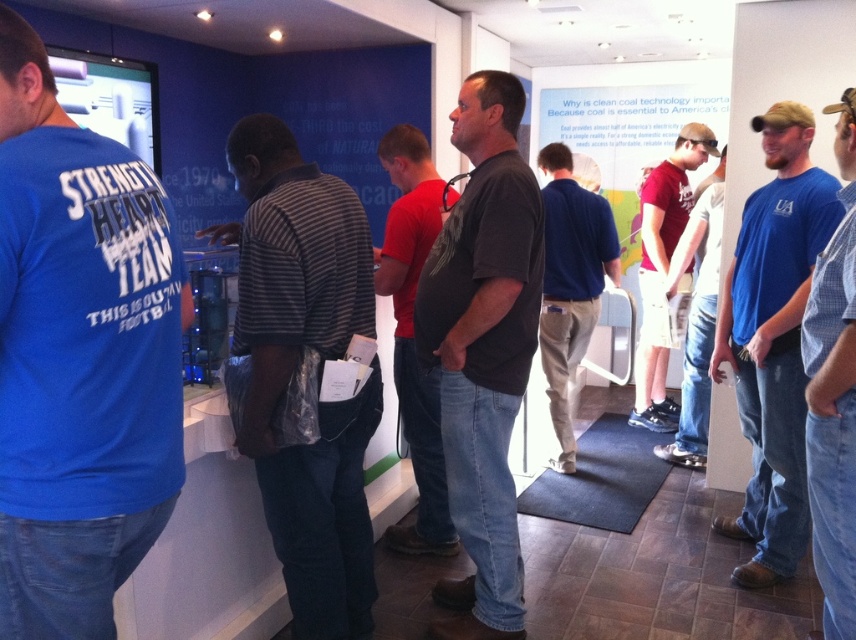
From the picture: You are standing in the exhibition space and see the black matte shirt at center. Can you determine its exact position using the coordinate system provided?

The black matte shirt at center is located at point (483, 349) according to the coordinate system provided.

You are a photographer setting up for a group photo. You notice two people wearing a black matte shirt at center and a matte red shirt at center. Which one is lower in the frame?

The black matte shirt at center is positioned under the matte red shirt at center, so it is lower in the frame.